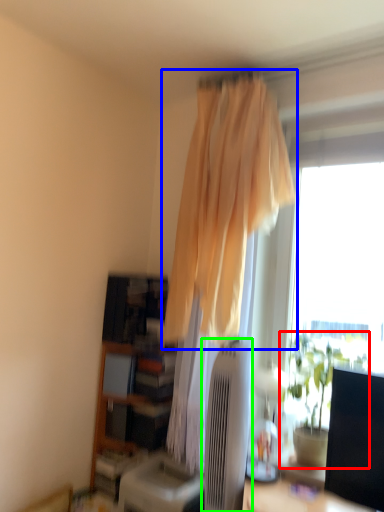
Question: Which object is positioned closest to houseplant (highlighted by a red box)? Select from curtain (highlighted by a blue box) and air conditioner (highlighted by a green box).

Choices:
 (A) curtain
 (B) air conditioner

Answer: (B)